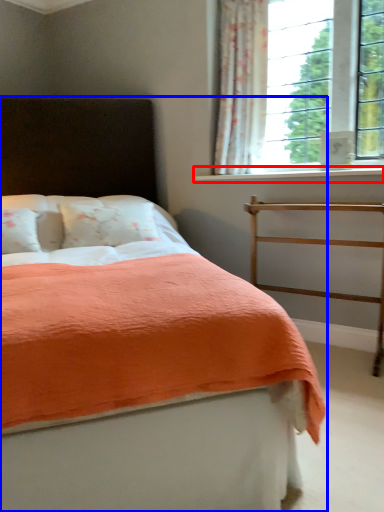
Question: Which point is further to the camera, window sill (highlighted by a red box) or bed (highlighted by a blue box)?

Choices:
 (A) window sill
 (B) bed

Answer: (A)